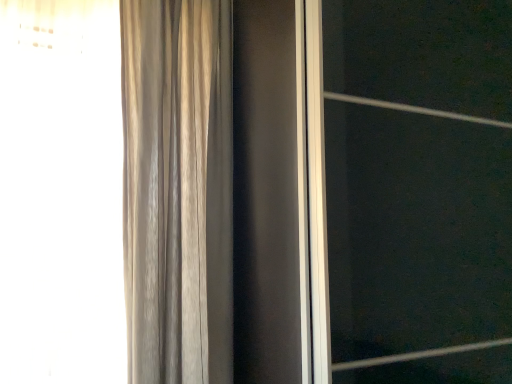
Where is `satin beige curtain at left`? satin beige curtain at left is located at coordinates (178, 190).

Describe the element at coordinates (178, 190) in the screenshot. I see `satin beige curtain at left` at that location.

This screenshot has width=512, height=384. Describe the element at coordinates (417, 189) in the screenshot. I see `transparent glass screen door at center` at that location.

What is the approximate width of transparent glass screen door at center?

transparent glass screen door at center is 22.85 inches wide.

I want to click on transparent glass screen door at center, so click(x=417, y=189).

Where is `satin beige curtain at left`? satin beige curtain at left is located at coordinates (178, 190).

Is satin beige curtain at left at the left side of transparent glass screen door at center?

Indeed, satin beige curtain at left is positioned on the left side of transparent glass screen door at center.

Which object is further away from the camera taking this photo, satin beige curtain at left or transparent glass screen door at center?

satin beige curtain at left.

Is point (204, 344) positioned after point (320, 74)?

Yes, point (204, 344) is farther from viewer.

From the image's perspective, is satin beige curtain at left beneath transparent glass screen door at center?

Incorrect, from the image's perspective, satin beige curtain at left is higher than transparent glass screen door at center.

From a real-world perspective, is satin beige curtain at left above or below transparent glass screen door at center?

From a real-world perspective, satin beige curtain at left is physically above transparent glass screen door at center.

Does satin beige curtain at left have a lesser width compared to transparent glass screen door at center?

Yes.

Can you confirm if satin beige curtain at left is shorter than transparent glass screen door at center?

Yes.

Does satin beige curtain at left have a larger size compared to transparent glass screen door at center?

No.

Is transparent glass screen door at center inside satin beige curtain at left?

No, transparent glass screen door at center is not inside satin beige curtain at left.

Would you consider satin beige curtain at left to be distant from transparent glass screen door at center?

No, satin beige curtain at left is not far away from transparent glass screen door at center.

Is satin beige curtain at left aimed at transparent glass screen door at center?

No.

What's the angular difference between satin beige curtain at left and transparent glass screen door at center's facing directions?

The facing directions of satin beige curtain at left and transparent glass screen door at center are 1.02 degrees apart.

How much distance is there between satin beige curtain at left and transparent glass screen door at center?

satin beige curtain at left and transparent glass screen door at center are 55.30 centimeters apart.

Image resolution: width=512 pixels, height=384 pixels. I want to click on screen door that is in front of the satin beige curtain at left, so click(x=417, y=189).

Between transparent glass screen door at center and satin beige curtain at left, which one appears on the right side from the viewer's perspective?

transparent glass screen door at center is more to the right.

Which object is closer to the camera, transparent glass screen door at center or satin beige curtain at left?

transparent glass screen door at center is in front.

Considering the points (471, 99) and (178, 172), which point is behind, point (471, 99) or point (178, 172)?

The point (178, 172) is more distant.

Consider the image. From the image's perspective, between transparent glass screen door at center and satin beige curtain at left, which one is located above?

satin beige curtain at left.

From a real-world perspective, is transparent glass screen door at center located higher than satin beige curtain at left?

Actually, transparent glass screen door at center is physically below satin beige curtain at left in the real world.

Is transparent glass screen door at center wider or thinner than satin beige curtain at left?

Clearly, transparent glass screen door at center has more width compared to satin beige curtain at left.

Considering the relative sizes of transparent glass screen door at center and satin beige curtain at left in the image provided, is transparent glass screen door at center shorter than satin beige curtain at left?

In fact, transparent glass screen door at center may be taller than satin beige curtain at left.

Who is smaller, transparent glass screen door at center or satin beige curtain at left?

Smaller between the two is satin beige curtain at left.

Would you say satin beige curtain at left is part of transparent glass screen door at center's contents?

Actually, satin beige curtain at left is outside transparent glass screen door at center.

Is transparent glass screen door at center beside satin beige curtain at left?

No, transparent glass screen door at center is not making contact with satin beige curtain at left.

Is transparent glass screen door at center positioned with its back to satin beige curtain at left?

transparent glass screen door at center is not turned away from satin beige curtain at left.

Find the location of a particular element. This screenshot has width=512, height=384. curtain above the transparent glass screen door at center (from the image's perspective) is located at coordinates (178, 190).

At what (x,y) coordinates should I click in order to perform the action: click on curtain behind the transparent glass screen door at center. Please return your answer as a coordinate pair (x, y). Looking at the image, I should click on (178, 190).

Identify the location of screen door below the satin beige curtain at left (from a real-world perspective). (417, 189).